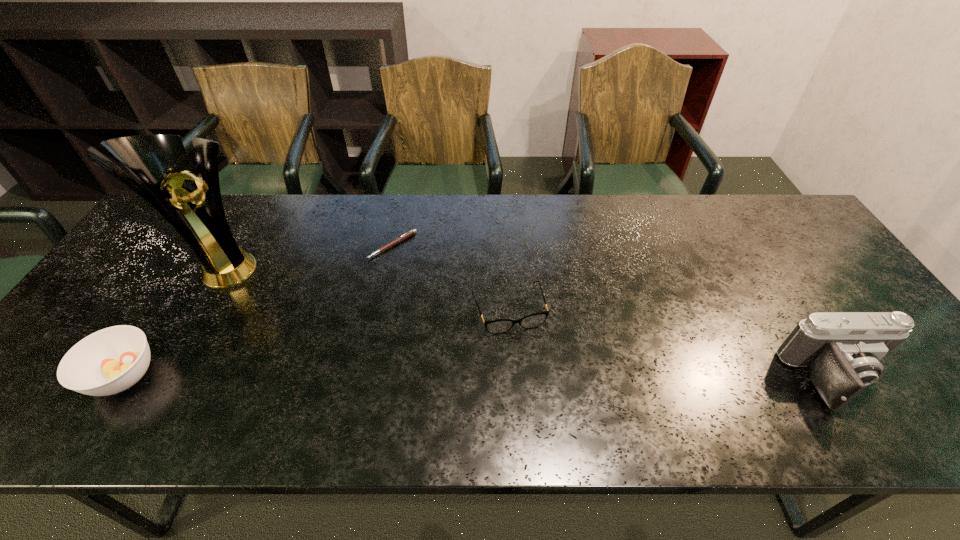
This screenshot has width=960, height=540. I want to click on empty space that is in between the soup bowl and the camera, so click(481, 377).

Identify the location of blank region between the second shortest object and the camera. (674, 345).

Where is `vacant area that lies between the spectacles and the rightmost object`? vacant area that lies between the spectacles and the rightmost object is located at coordinates (674, 345).

I want to click on unoccupied position between the tallest object and the fourth tallest object, so click(364, 289).

Find the location of a particular element. This screenshot has height=540, width=960. unoccupied area between the second object from right to left and the third shortest object is located at coordinates (316, 343).

Image resolution: width=960 pixels, height=540 pixels. I want to click on unoccupied area between the third shortest object and the shortest object, so click(258, 310).

Image resolution: width=960 pixels, height=540 pixels. What are the coordinates of `empty location between the third tallest object and the rightmost object` in the screenshot? It's located at (481, 377).

Identify the location of vacant area that lies between the fourth object from left to right and the award. The image size is (960, 540). (364, 289).

Identify the location of the closest object to the spectacles. (411, 232).

Point out which object is positioned as the nearest to the third object from right to left. Please provide its 2D coordinates. Your answer should be formatted as a tuple, i.e. [(x, y)], where the tuple contains the x and y coordinates of a point satisfying the conditions above.

[(498, 326)]